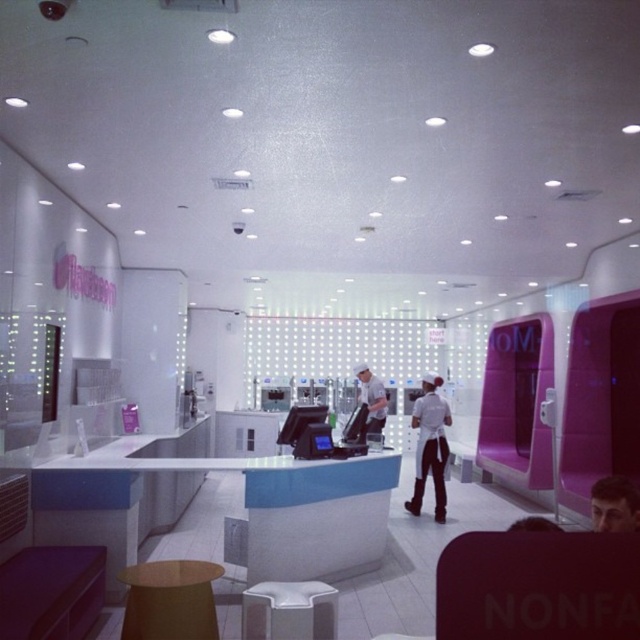
Question: Which object is the closest to the white fabric apron at center?

Choices:
 (A) smooth skin face at center
 (B) white uniform at center
 (C) brown leather stool at lower center
 (D) white plastic stool at center

Answer: (B)

Question: Is smooth skin face at center wider than white uniform at center?

Choices:
 (A) no
 (B) yes

Answer: (B)

Question: Is brown leather stool at lower center below white uniform at center?

Choices:
 (A) yes
 (B) no

Answer: (A)

Question: From the image, what is the correct spatial relationship of white plastic stool at center in relation to smooth skin face at center?

Choices:
 (A) left
 (B) right

Answer: (A)

Question: Which of the following is the farthest from the observer?

Choices:
 (A) white plastic stool at center
 (B) brown leather stool at lower center
 (C) smooth skin face at center

Answer: (B)

Question: Which point appears farthest from the camera in this image?

Choices:
 (A) (356, 371)
 (B) (272, 592)

Answer: (A)